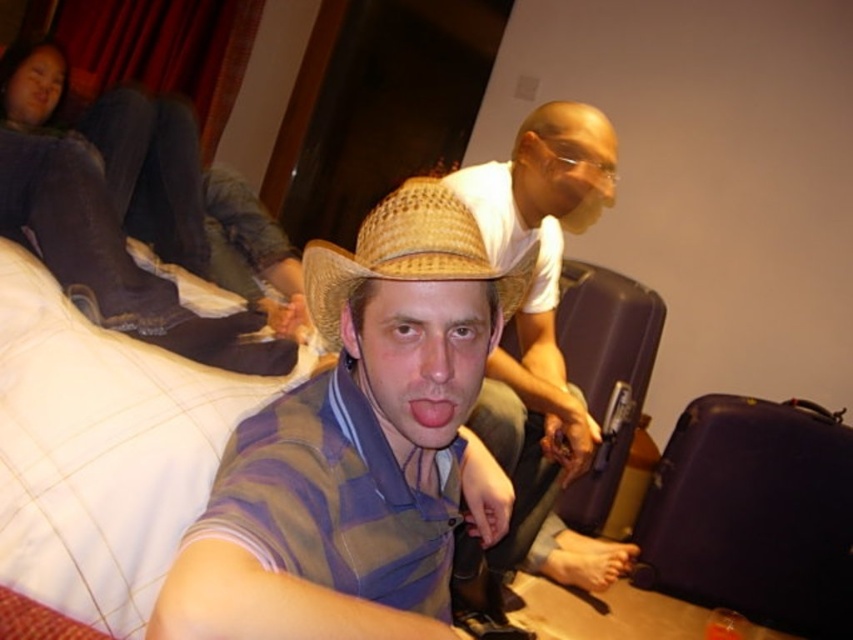
You are trying to pack your belongings into the purple matte suitcase at lower right and the matte straw hat at center. If the suitcase can only hold items smaller than its width, will both items fit inside?

The purple matte suitcase at lower right is wider than the matte straw hat at center, so the hat can fit inside the suitcase. However, the suitcase cannot fit into itself, so only the hat can be placed inside the suitcase.

From the picture: You are a photographer setting up a shoot in this room. You want to position a new prop so it is between the purple matte suitcase at lower right and the pink glossy lips at center. Where should you place the prop?

The prop should be placed between the purple matte suitcase at lower right and the pink glossy lips at center, which are positioned vertically with the suitcase below the lips. Therefore, place the prop in the middle of the vertical space between them.